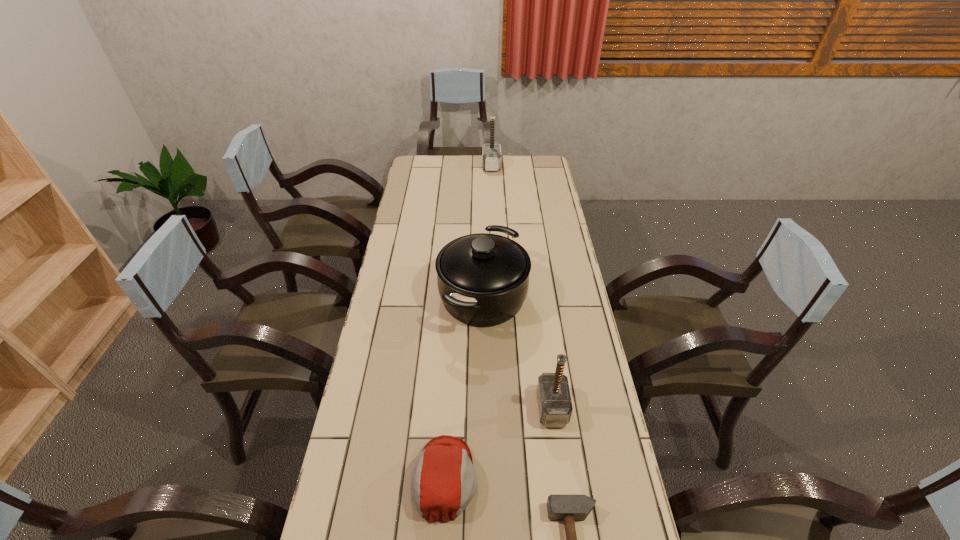
Locate an element on the screen. the leftmost hammer is located at coordinates (491, 155).

This screenshot has height=540, width=960. What are the coordinates of `the farthest hammer` in the screenshot? It's located at (491, 155).

This screenshot has height=540, width=960. I want to click on the fourth nearest object, so click(x=483, y=278).

I want to click on the third nearest object, so click(555, 408).

At what (x,y) coordinates should I click in order to perform the action: click on the second shortest object. Please return your answer as a coordinate pair (x, y). This screenshot has height=540, width=960. Looking at the image, I should click on (443, 482).

The width and height of the screenshot is (960, 540). I want to click on vacant area situated 0.360m for striking with the head of the leftmost hammer, so click(414, 166).

Image resolution: width=960 pixels, height=540 pixels. Find the location of `free space located 0.090m for striking with the head of the leftmost hammer`. free space located 0.090m for striking with the head of the leftmost hammer is located at coordinates (466, 166).

You are a GUI agent. You are given a task and a screenshot of the screen. Output one action in this format:
    pyautogui.click(x=<x>, y=<y>)
    Task: Click on the vacant space located for striking with the head of the leftmost hammer
    The width and height of the screenshot is (960, 540).
    Given the screenshot: What is the action you would take?
    pyautogui.click(x=444, y=166)

Find the location of `free space located 0.300m on the front of the fourth nearest object`. free space located 0.300m on the front of the fourth nearest object is located at coordinates (484, 428).

Find the location of a particular element. vacant region located 0.110m on the back of the third farthest object is located at coordinates (545, 359).